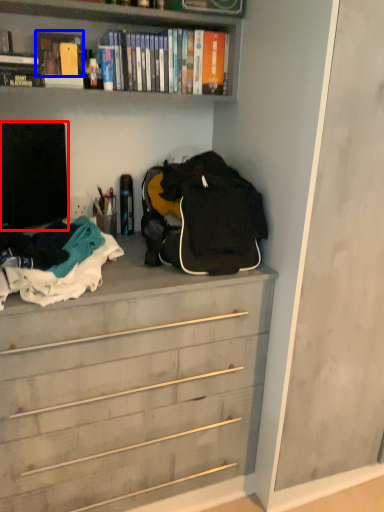
Question: Among these objects, which one is nearest to the camera, television (highlighted by a red box) or book (highlighted by a blue box)?

Choices:
 (A) television
 (B) book

Answer: (A)